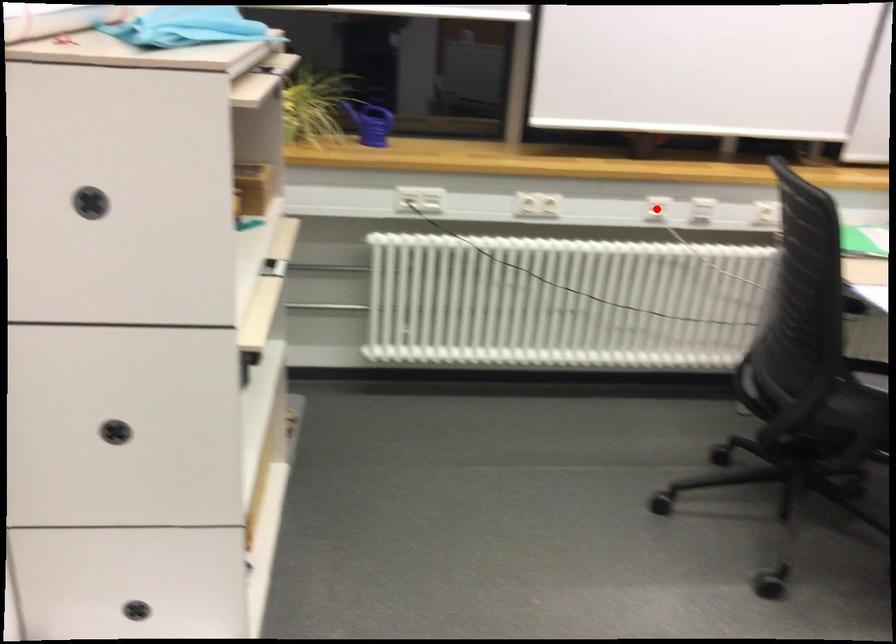
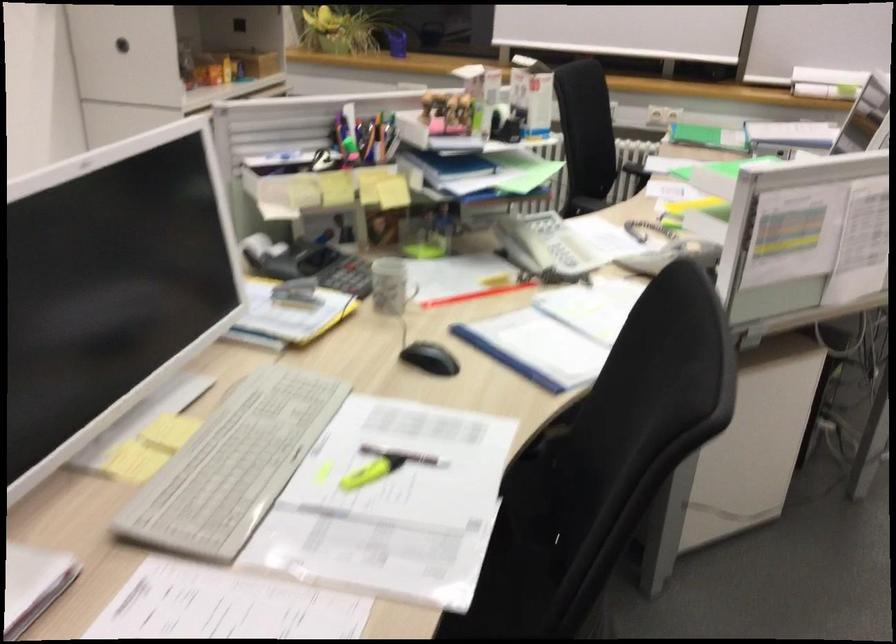
Question: I am providing you with two images of the same scene from different viewpoints. A red point is marked on the first image. Is the red point's position out of view in image 2?

Choices:
 (A) Yes
 (B) No

Answer: (A)